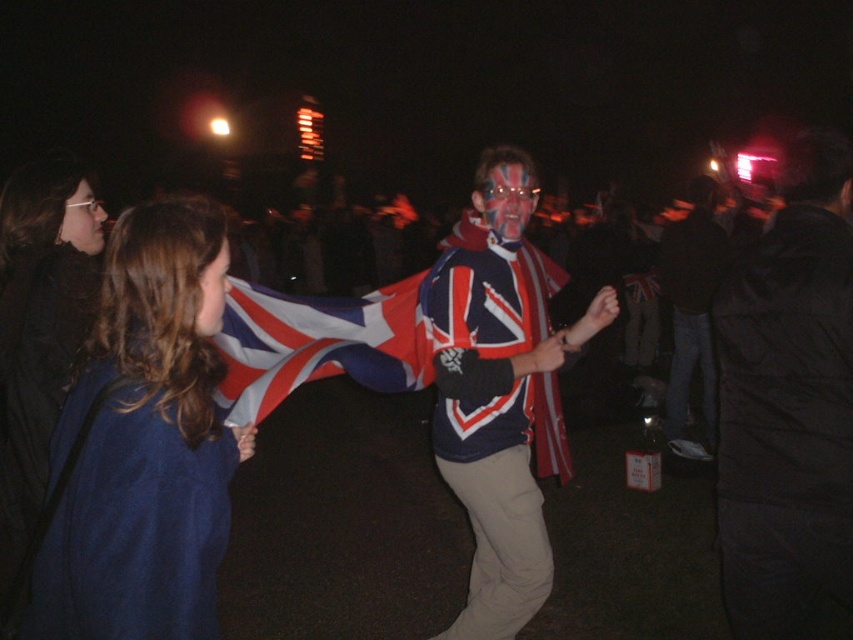
Is point (827, 321) positioned before point (416, 330)?

That is True.

Is dark blue padded jacket at right further to camera compared to union jack flag at center?

That is True.

The width and height of the screenshot is (853, 640). Identify the location of dark blue padded jacket at right. (788, 401).

Identify the location of dark blue padded jacket at right. The width and height of the screenshot is (853, 640). (788, 401).

Measure the distance between point [402,312] and camera.

Point [402,312] is 2.87 meters away from camera.

Between point (276, 385) and point (492, 193), which one is positioned in front?

Point (276, 385) is in front.

Describe the element at coordinates (316, 344) in the screenshot. I see `union jack flag at center` at that location.

Find the location of a particular element. Image resolution: width=853 pixels, height=640 pixels. union jack flag at center is located at coordinates (316, 344).

Is dark blue padded jacket at right wider than matte red flag at center?

Yes.

Which is below, dark blue padded jacket at right or matte red flag at center?

dark blue padded jacket at right is lower down.

Is point (836, 252) closer to viewer compared to point (204, 284)?

No.

The image size is (853, 640). What are the coordinates of `dark blue padded jacket at right` in the screenshot? It's located at (788, 401).